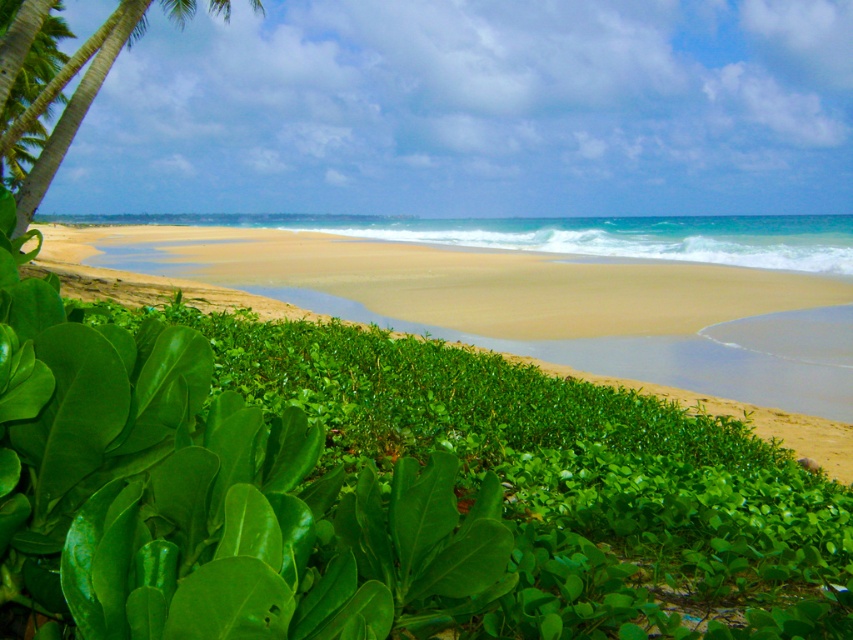
You are standing at the point where the green leafy vegetation at lower left is located at point (438, 280). Which direction should you walk to reach the beach?

The green leafy vegetation at lower left is located at point 0.495, 0.515. Since the beach is in the lower right direction from this point, you should walk towards the lower right to reach the beach.

In the scene shown: You are a hiker who has just arrived at the beach. You notice the green leafy vegetation at lower left and the green leafy palm tree at upper left. Which one is taller?

The green leafy palm tree at upper left is taller than the green leafy vegetation at lower left.

You are standing on the beach and want to take a photo of both the green leafy vegetation at lower left and the green leafy palm tree at upper left. Which object should you zoom in on first to ensure both fit in the frame?

The green leafy vegetation at lower left might be wider than the green leafy palm tree at upper left, so you should zoom in on the vegetation first to accommodate its width before adjusting for the palm tree.